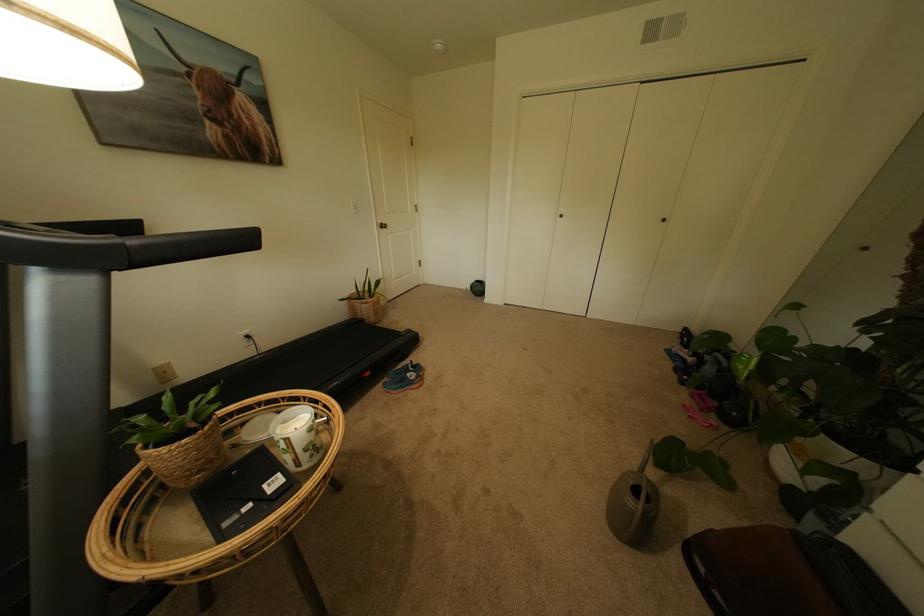
Image resolution: width=924 pixels, height=616 pixels. Describe the element at coordinates (322, 419) in the screenshot. I see `a white mug handle` at that location.